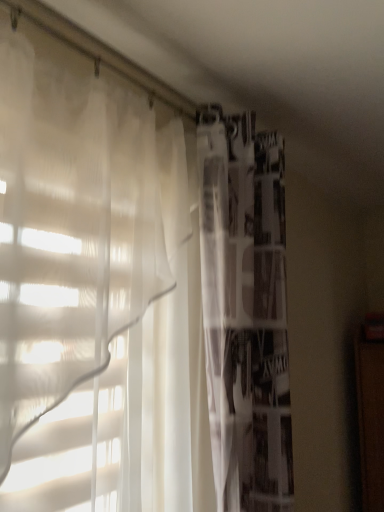
What do you see at coordinates (245, 309) in the screenshot?
I see `translucent paper-like curtain at center` at bounding box center [245, 309].

Locate an element on the screen. The height and width of the screenshot is (512, 384). translucent paper-like curtain at center is located at coordinates (245, 309).

Identify the location of translucent paper-like curtain at center. The height and width of the screenshot is (512, 384). (245, 309).